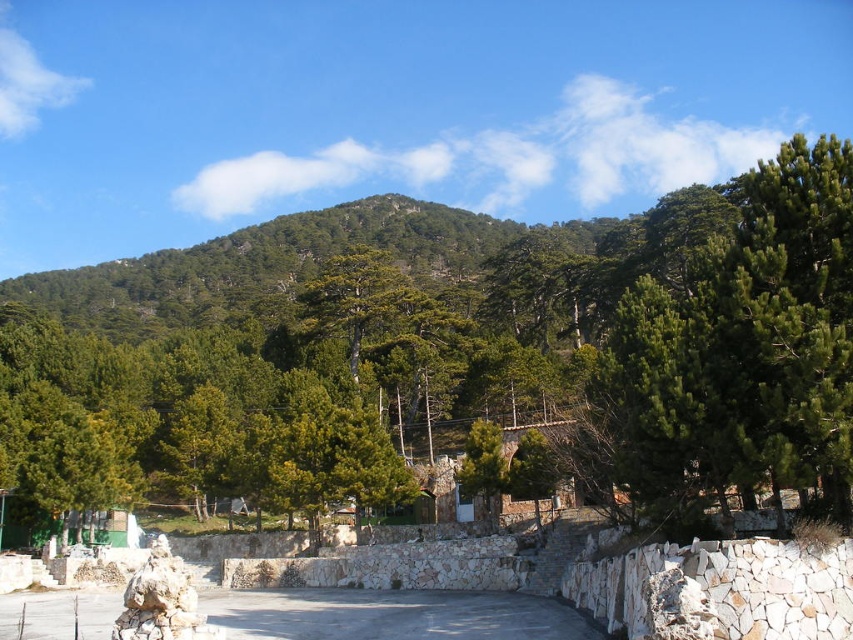
Question: Among these points, which one is farthest from the camera?

Choices:
 (A) (337, 268)
 (B) (630, 410)

Answer: (A)

Question: In this image, where is green textured tree at center located relative to green needle-like tree at upper right?

Choices:
 (A) left
 (B) right

Answer: (A)

Question: Which object appears closest to the camera in this image?

Choices:
 (A) green textured tree at center
 (B) green needle-like tree at upper right

Answer: (B)

Question: Can you confirm if green textured tree at center is positioned to the right of green needle-like tree at upper right?

Choices:
 (A) no
 (B) yes

Answer: (A)

Question: Does green textured tree at center appear under green needle-like tree at upper right?

Choices:
 (A) no
 (B) yes

Answer: (A)